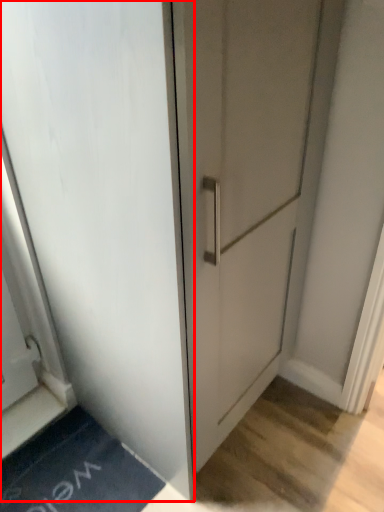
Question: From the image's perspective, what is the correct spatial positioning of door (annotated by the red box) in reference to bath mat?

Choices:
 (A) below
 (B) above

Answer: (B)